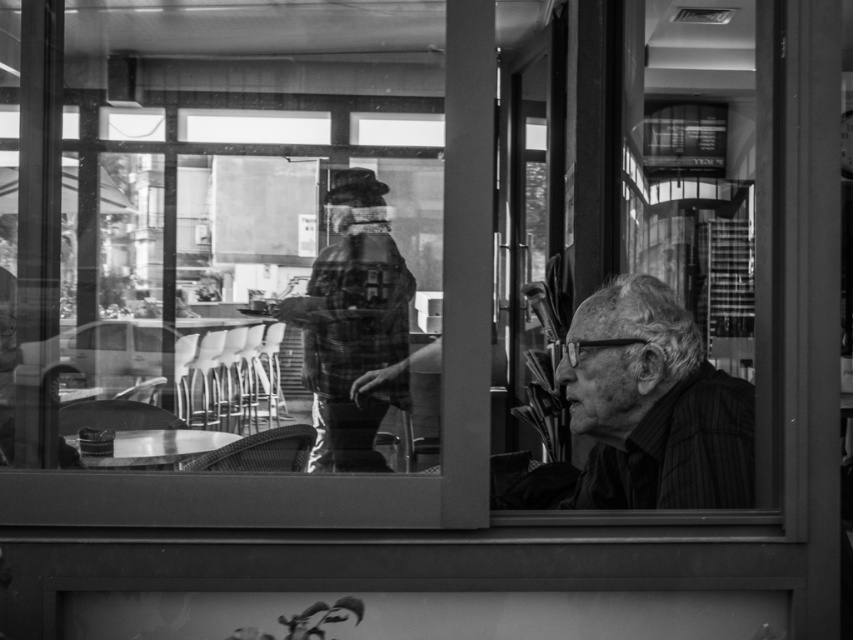
Question: Considering the real-world distances, which object is closest to the metallic table at lower left?

Choices:
 (A) plaid fabric jacket at center
 (B) smooth black shirt at right

Answer: (A)

Question: Is plaid fabric jacket at center thinner than metallic table at lower left?

Choices:
 (A) no
 (B) yes

Answer: (A)

Question: Can you confirm if plaid fabric jacket at center is bigger than metallic table at lower left?

Choices:
 (A) no
 (B) yes

Answer: (B)

Question: Estimate the real-world distances between objects in this image. Which object is farther from the plaid fabric jacket at center?

Choices:
 (A) smooth black shirt at right
 (B) metallic table at lower left

Answer: (A)

Question: Is smooth black shirt at right smaller than metallic table at lower left?

Choices:
 (A) yes
 (B) no

Answer: (B)

Question: Which point is closer to the camera?

Choices:
 (A) (135, 442)
 (B) (614, 416)
 (C) (355, 460)

Answer: (B)